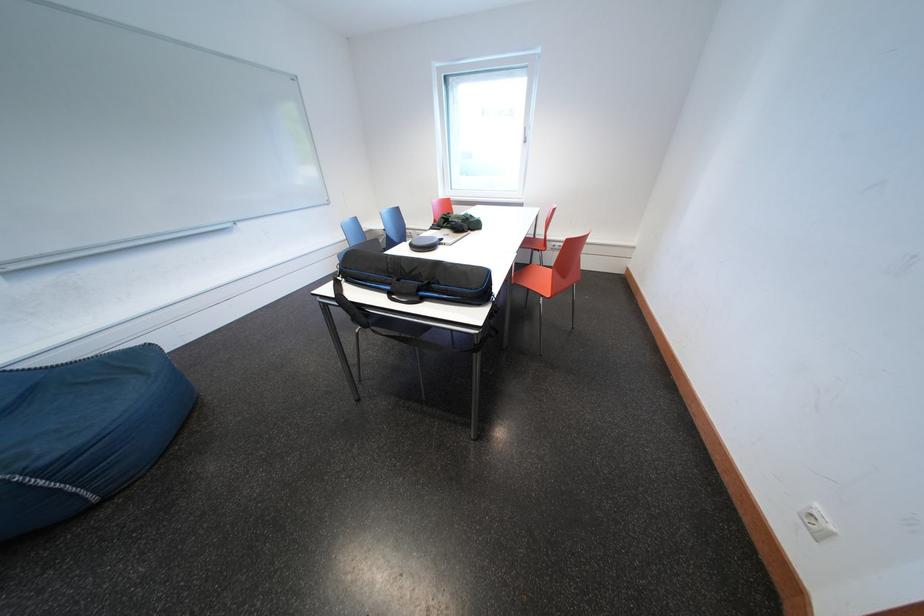
Find where to lift the black bag handle. Please return your answer as a coordinate pair (x, y).

(428, 307)